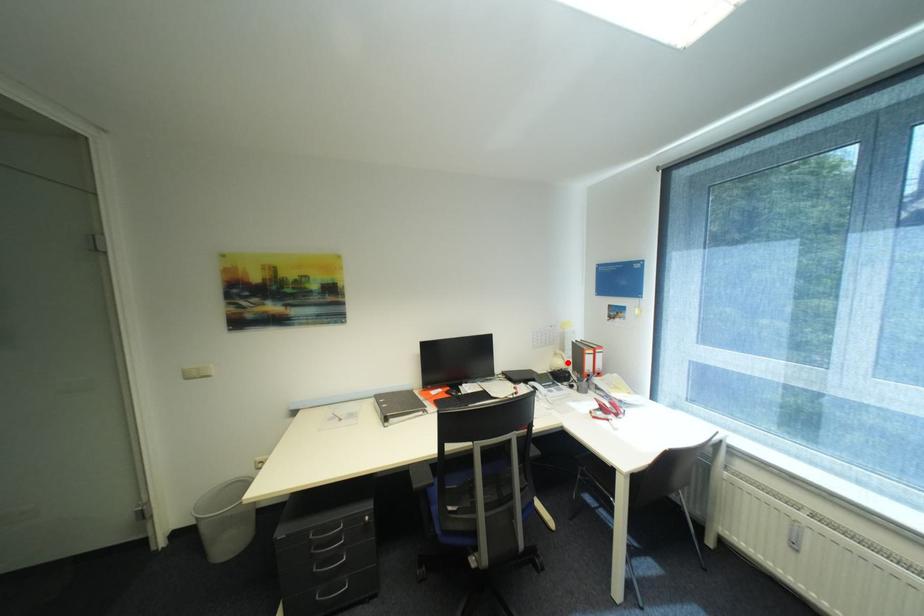
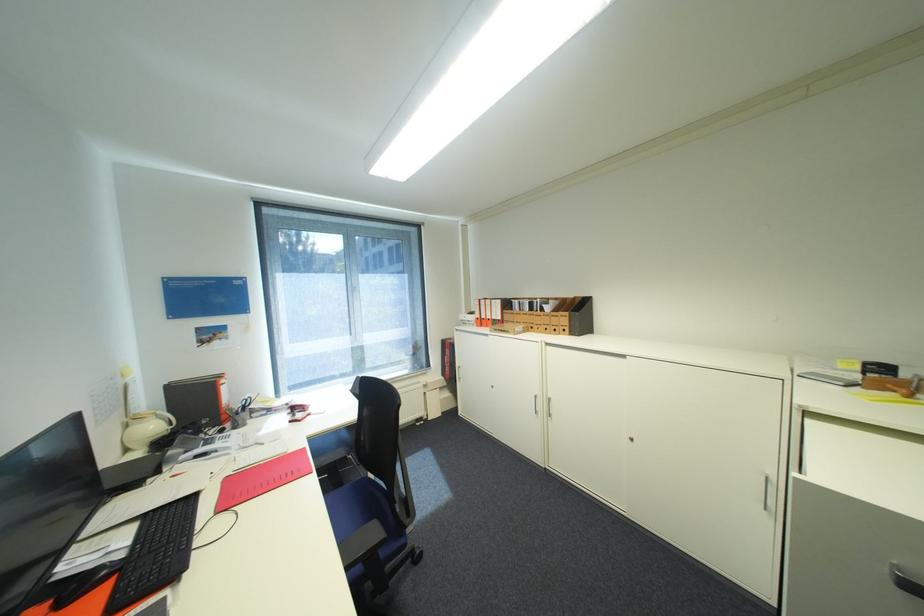
Question: A red point is marked in image1. In image2, is the corresponding 3D point closer to the camera or farther? Reply with the corresponding letter.

Choices:
 (A) The corresponding 3D point is closer.
 (B) The corresponding 3D point is farther.

Answer: (A)